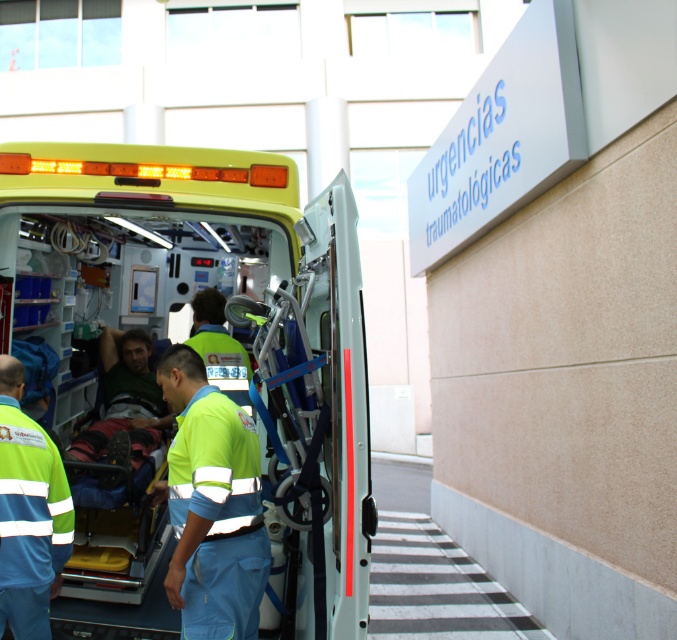
Question: Among these points, which one is nearest to the camera?

Choices:
 (A) (244, 512)
 (B) (200, 604)
 (C) (206, 336)
 (D) (22, 531)

Answer: (B)

Question: Does neon yellow fabric at center have a lesser width compared to green reflective uniform at center?

Choices:
 (A) yes
 (B) no

Answer: (B)

Question: Is neon yellow fabric at center wider than green fabric shirt at center?

Choices:
 (A) yes
 (B) no

Answer: (B)

Question: Among these points, which one is farthest from the camera?

Choices:
 (A) (190, 339)
 (B) (110, 381)
 (C) (56, 477)

Answer: (B)

Question: Can you confirm if green reflective uniform at center is smaller than green fabric shirt at center?

Choices:
 (A) no
 (B) yes

Answer: (B)

Question: Which of the following is the farthest from the observer?

Choices:
 (A) (131, 339)
 (B) (185, 339)
 (C) (221, 624)
 (D) (58, 477)

Answer: (B)